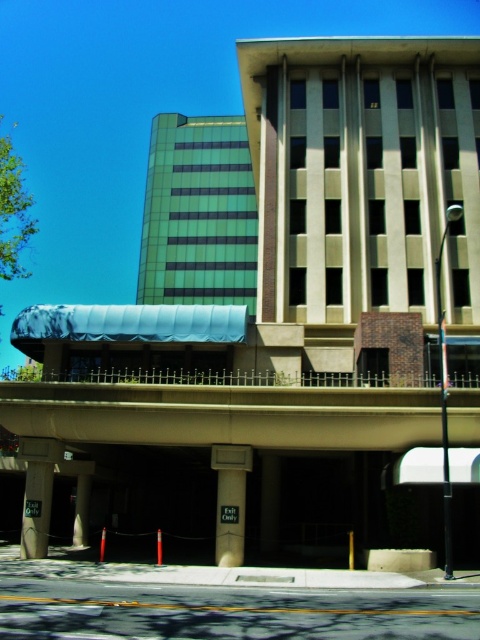
You are standing at the entrance of the building and want to reach the blue awning. Which pillar should you walk around to get there? The white glossy pillar at center or the concrete pillar at lower left?

The white glossy pillar at center is in front of the concrete pillar at lower left, so you should walk around the white glossy pillar at center to reach the blue awning.

You are standing at the entrance of the building and want to reach a specific point marked as point (37, 461). Given that you can only move along the covered walkway, which is 20 meters long, will you be able to reach the point without stepping into direct sunlight?

The distance of point (37, 461) from viewer is 23.55 meters, so no, the covered walkway is only 20 meters long, meaning you will have to step into direct sunlight to reach point (37, 461).

You are standing on the covered walkway in front of the building. You notice two pillars supporting the walkway. Which pillar is higher from the ground? The white glossy pillar at center or the concrete pillar at lower left?

The white glossy pillar at center is higher from the ground than the concrete pillar at lower left because it is positioned above it.